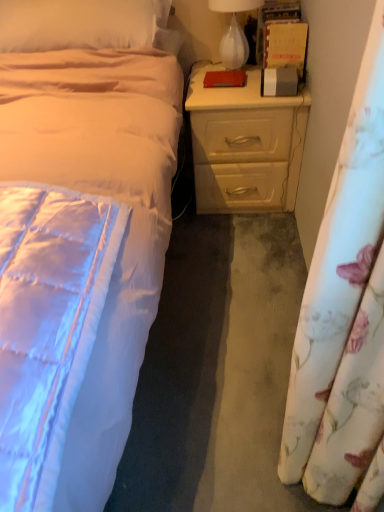
Image resolution: width=384 pixels, height=512 pixels. In order to click on vacant area that is in front of beige wood nightstand at right in this screenshot , I will do `click(236, 246)`.